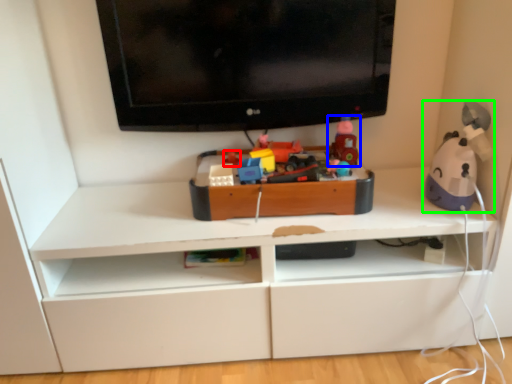
Question: Considering the real-world distances, which object is closest to toy (highlighted by a red box)? toy (highlighted by a blue box) or toy (highlighted by a green box).

Choices:
 (A) toy
 (B) toy

Answer: (A)